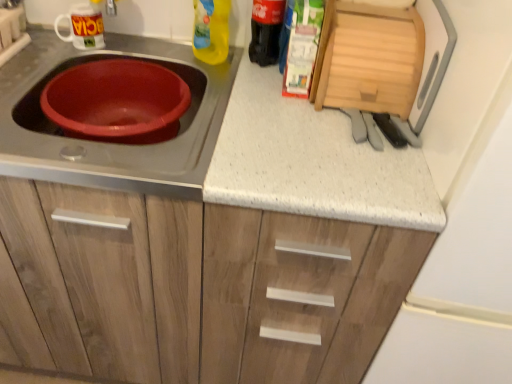
The height and width of the screenshot is (384, 512). What are the coordinates of `free space in front of wooden cutting board at upper right, the first appliance viewed from the right` in the screenshot? It's located at (334, 140).